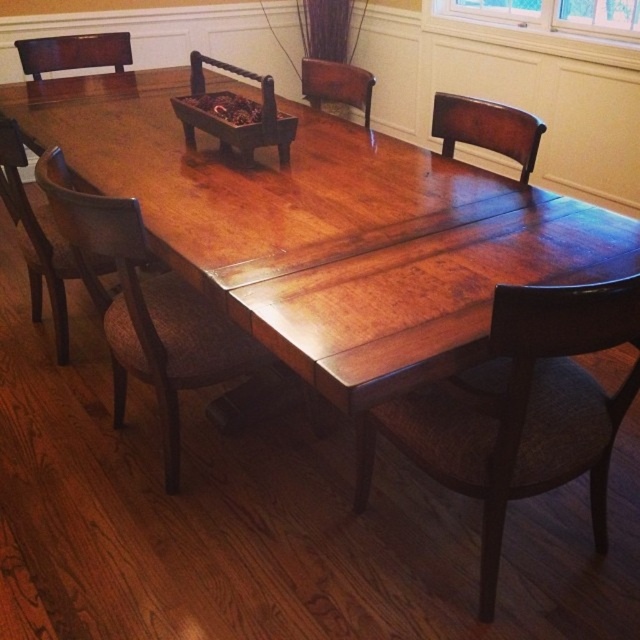
In the scene shown: Between brown woven chair at lower right and clear glass window at upper center, which one is positioned lower?

Positioned lower is brown woven chair at lower right.

Does brown woven chair at lower right have a lesser width compared to clear glass window at upper center?

Correct, brown woven chair at lower right's width is less than clear glass window at upper center's.

The image size is (640, 640). In order to click on brown woven chair at lower right in this screenshot , I will do `click(518, 410)`.

Between brown fabric chair at left and dark brown wood armchair at upper left, which one is positioned lower?

brown fabric chair at left

Who is positioned more to the right, brown fabric chair at left or dark brown wood armchair at upper left?

brown fabric chair at left is more to the right.

At what (x,y) coordinates should I click in order to perform the action: click on brown fabric chair at left. Please return your answer as a coordinate pair (x, y). Looking at the image, I should click on (36, 237).

From the picture: Can you confirm if dark brown wood armchair at upper left is thinner than mahogany wood armchair at upper center?

Incorrect, dark brown wood armchair at upper left's width is not less than mahogany wood armchair at upper center's.

Measure the distance between dark brown wood armchair at upper left and mahogany wood armchair at upper center.

They are 1.11 meters apart.

Where is `dark brown wood armchair at upper left`? The height and width of the screenshot is (640, 640). dark brown wood armchair at upper left is located at coordinates (74, 52).